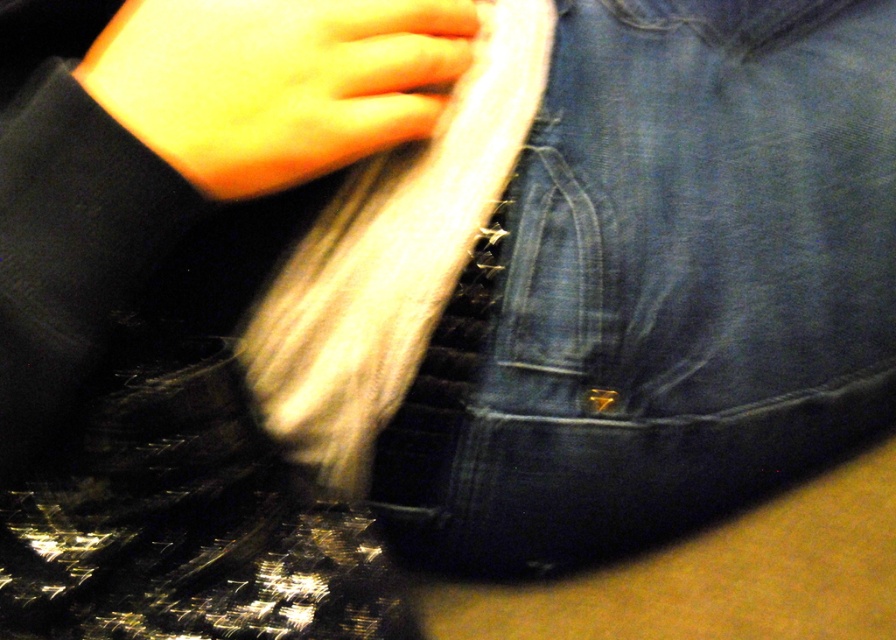
Question: Is denim at center to the right of smooth yellow skin at upper center from the viewer's perspective?

Choices:
 (A) no
 (B) yes

Answer: (B)

Question: Does denim at center have a lesser width compared to smooth yellow skin at upper center?

Choices:
 (A) no
 (B) yes

Answer: (A)

Question: Which point is farther to the camera?

Choices:
 (A) smooth yellow skin at upper center
 (B) denim at center

Answer: (B)

Question: Which of the following is the farthest from the observer?

Choices:
 (A) smooth yellow skin at upper center
 (B) denim at center

Answer: (B)

Question: Observing the image, what is the correct spatial positioning of denim at center in reference to smooth yellow skin at upper center?

Choices:
 (A) below
 (B) above

Answer: (A)